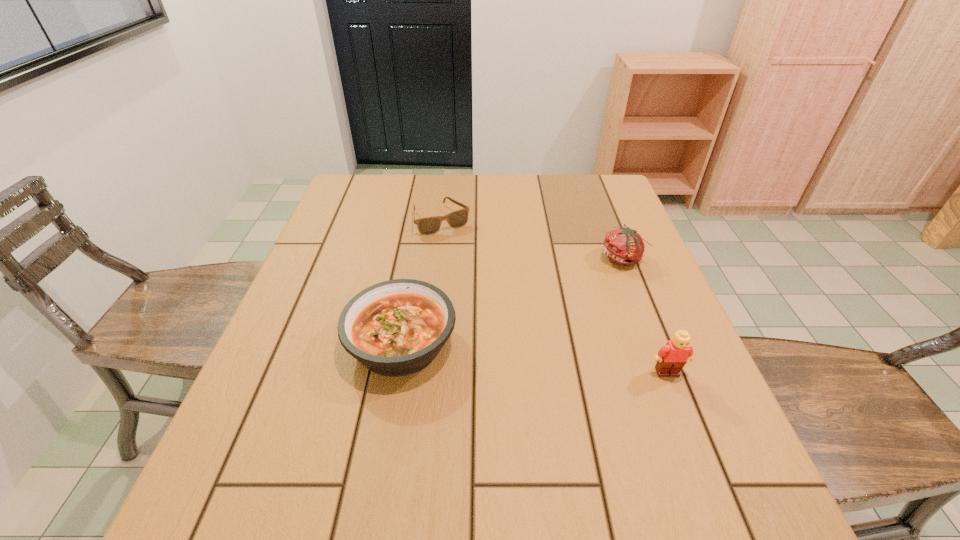
What are the coordinates of `vacant space on the desktop that is between the stew and the tallest object and is positioned on the front-facing side of the tomato` in the screenshot? It's located at (500, 354).

Find the location of a particular element. Image resolution: width=960 pixels, height=540 pixels. vacant space on the desktop that is between the stew and the Lego and is positioned on the frames of the farthest object is located at coordinates (536, 359).